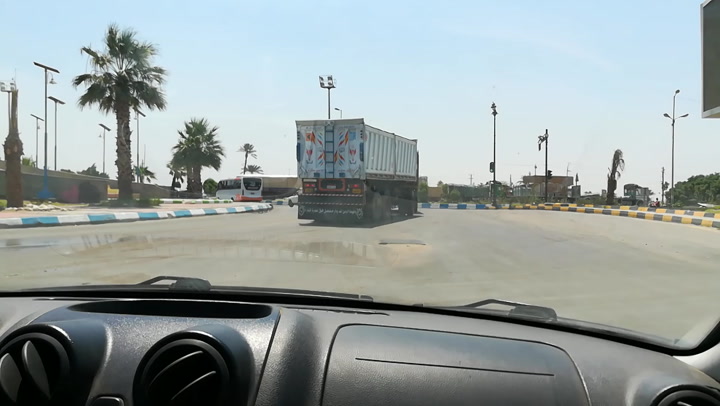
This screenshot has height=406, width=720. What are the coordinates of `ladder` in the screenshot? It's located at (328, 132), (328, 141), (328, 151), (328, 165).